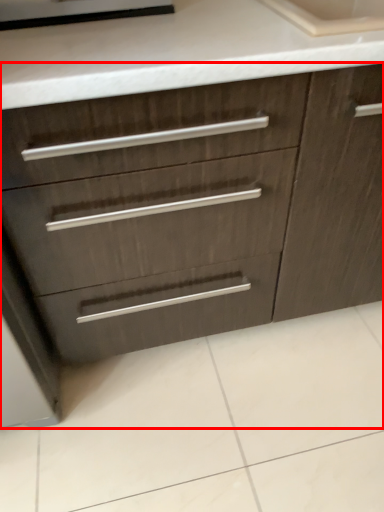
Question: From the image's perspective, where is chest of drawers (annotated by the red box) located relative to appliance?

Choices:
 (A) above
 (B) below

Answer: (B)